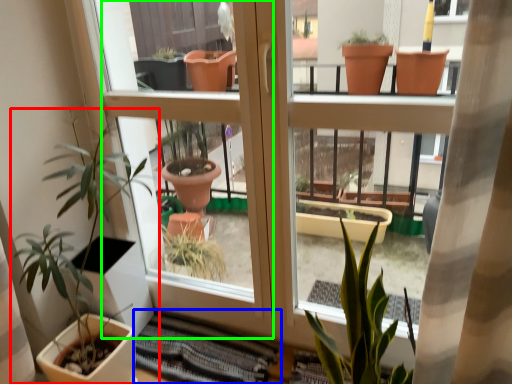
Question: Based on their relative distances, which object is farther from houseplant (highlighted by a red box)? Choose from atrium (highlighted by a blue box) and screen door (highlighted by a green box).

Choices:
 (A) atrium
 (B) screen door

Answer: (A)